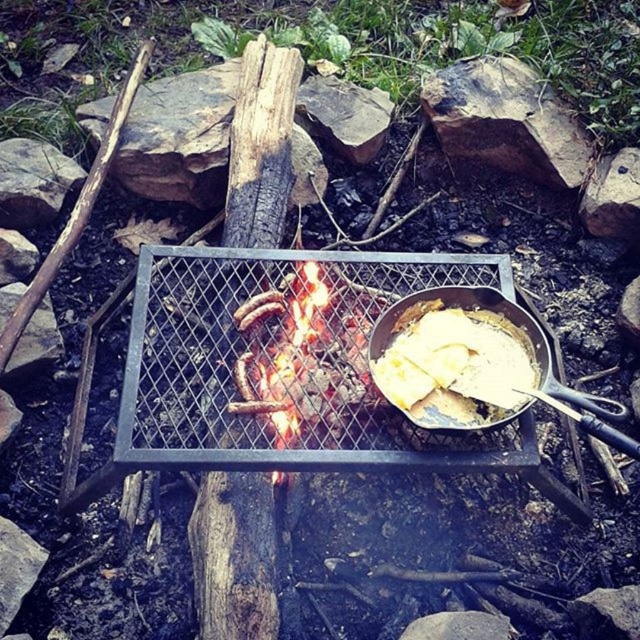
Question: Observing the image, what is the correct spatial positioning of silver/black cast iron frying pan at center in reference to white creamy food at center?

Choices:
 (A) above
 (B) below

Answer: (B)

Question: Which of the following is the farthest from the observer?

Choices:
 (A) brown rough rock at upper center
 (B) silver/black cast iron frying pan at center

Answer: (A)

Question: Among these points, which one is nearest to the camera?

Choices:
 (A) (497, 316)
 (B) (493, 160)
 (C) (413, 420)

Answer: (C)

Question: Does silver/black cast iron frying pan at center appear over white creamy food at center?

Choices:
 (A) yes
 (B) no

Answer: (B)

Question: Which point is closer to the camera?

Choices:
 (A) brown rough rock at upper center
 (B) silver/black cast iron frying pan at center

Answer: (B)

Question: Where is silver/black cast iron frying pan at center located in relation to white creamy food at center in the image?

Choices:
 (A) left
 (B) right

Answer: (B)